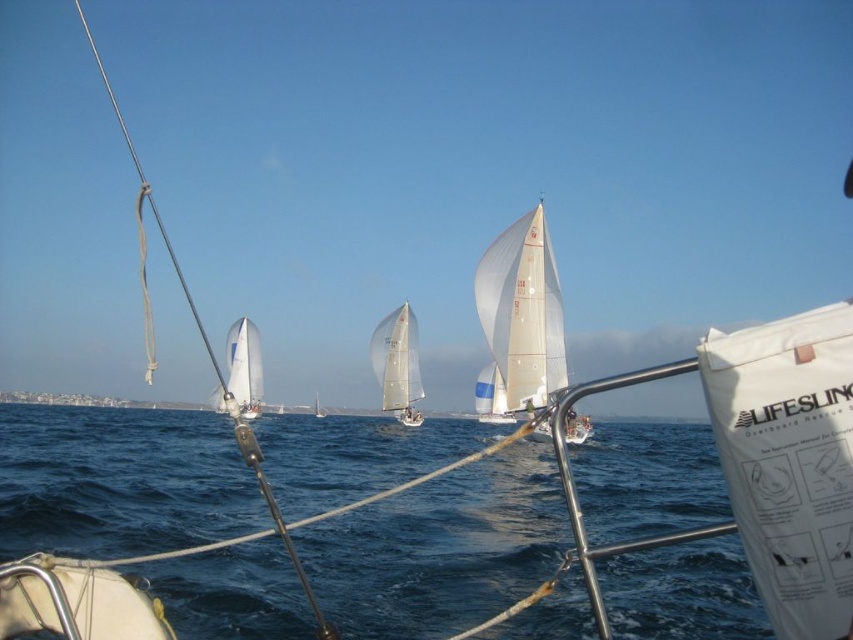
You are on a sailboat and need to locate the transparent sailboat at center and the white sailboat at left. From your current position on the boat, which one appears closer to the bottom of the view?

The transparent sailboat at center appears closer to the bottom of the view because it is positioned below the white sailboat at left.

You are a sailor on a boat and you need to estimate the space between two objects in the scene. Which object is wider, the blue water at center or the transparent sailboat at center?

The blue water at center is wider than the transparent sailboat at center according to the description.

You are on a sailboat and see the point marked at coordinates (440,548). What is located at that point?

The point marked at coordinates (440,548) is blue water at center.